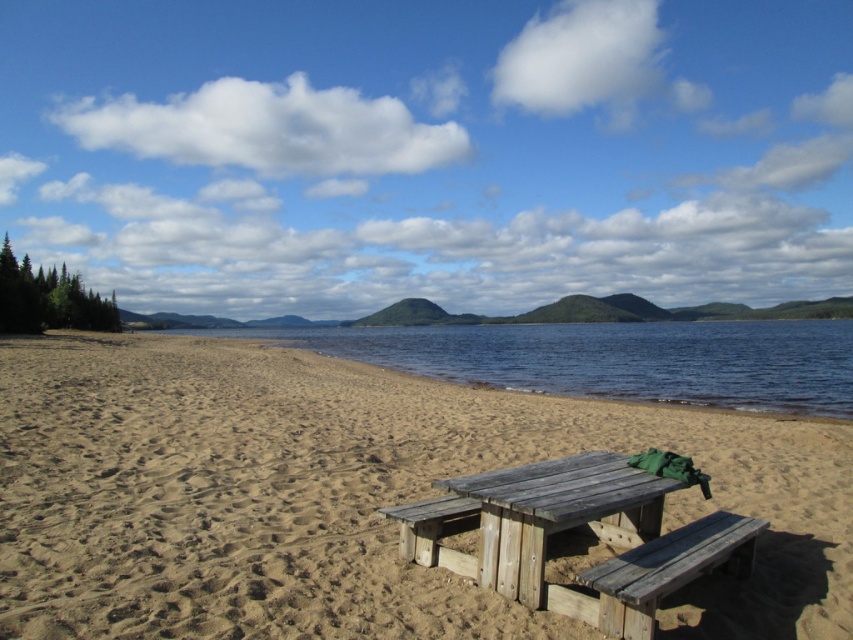
Which is behind, point (76, 472) or point (666, 579)?

The point (76, 472) is behind.

Which of these two, brown sandy beach at center or wooden park bench at lower right, stands taller?

With more height is brown sandy beach at center.

Which is in front, point (428, 451) or point (682, 584)?

Positioned in front is point (682, 584).

Locate an element on the screen. The image size is (853, 640). brown sandy beach at center is located at coordinates (350, 496).

Can you confirm if weathered wood picnic table at center is smaller than wooden park bench at lower right?

Incorrect, weathered wood picnic table at center is not smaller in size than wooden park bench at lower right.

From the picture: Does weathered wood picnic table at center appear on the right side of wooden park bench at lower right?

In fact, weathered wood picnic table at center is to the left of wooden park bench at lower right.

Find the location of a particular element. This screenshot has height=640, width=853. weathered wood picnic table at center is located at coordinates (556, 513).

Is brown sandy beach at center wider than weathered wood picnic table at center?

Yes, brown sandy beach at center is wider than weathered wood picnic table at center.

Who is positioned more to the left, brown sandy beach at center or weathered wood picnic table at center?

Positioned to the left is brown sandy beach at center.

This screenshot has width=853, height=640. I want to click on brown sandy beach at center, so click(350, 496).

Image resolution: width=853 pixels, height=640 pixels. In order to click on brown sandy beach at center in this screenshot , I will do `click(350, 496)`.